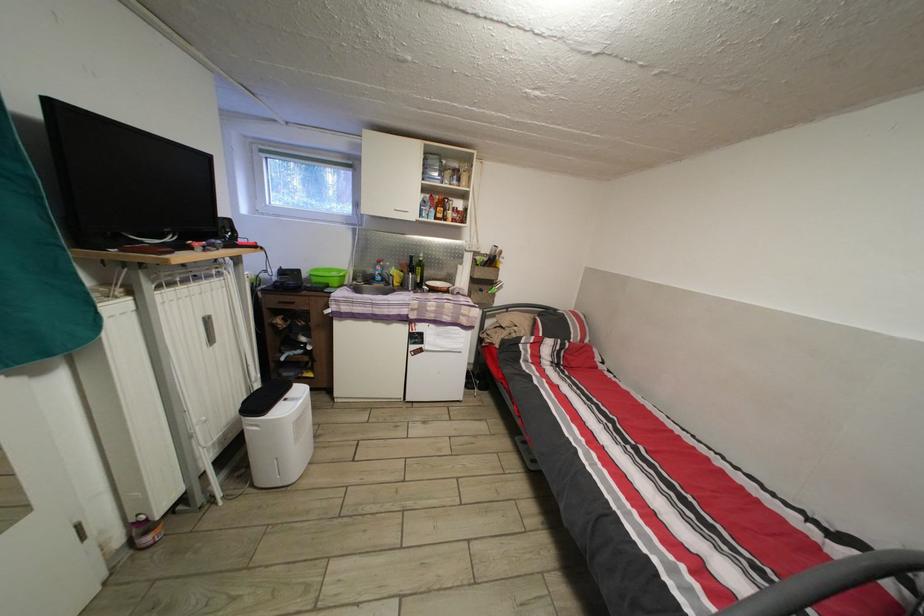
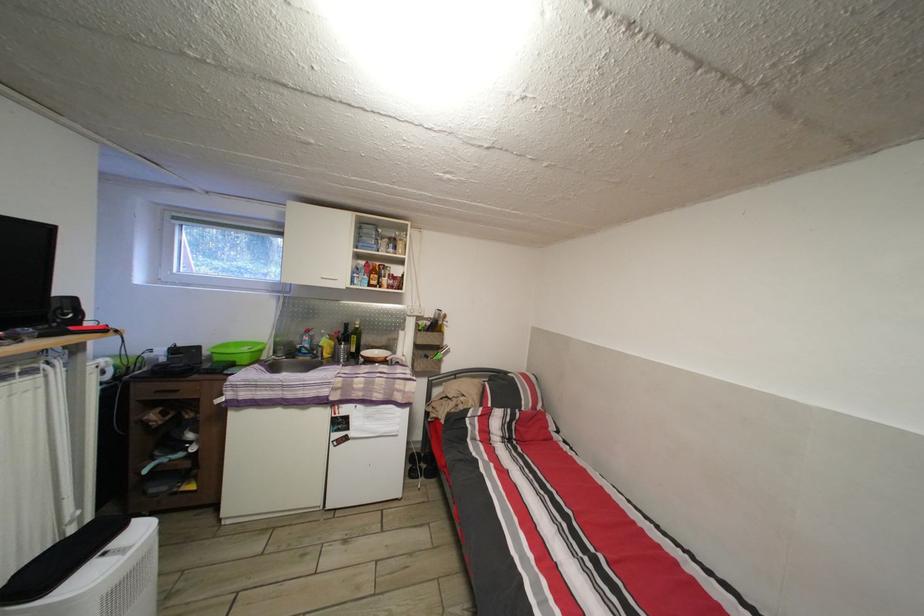
The point at (x=311, y=282) is marked in the first image. Where is the corresponding point in the second image?

(213, 359)